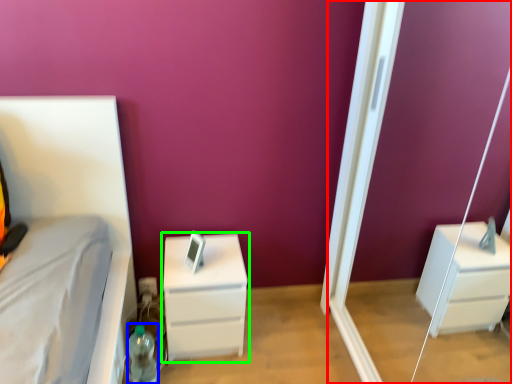
Question: Considering the real-world distances, which object is farthest from screen door (highlighted by a red box)? bottle (highlighted by a blue box) or chest of drawers (highlighted by a green box)?

Choices:
 (A) bottle
 (B) chest of drawers

Answer: (A)